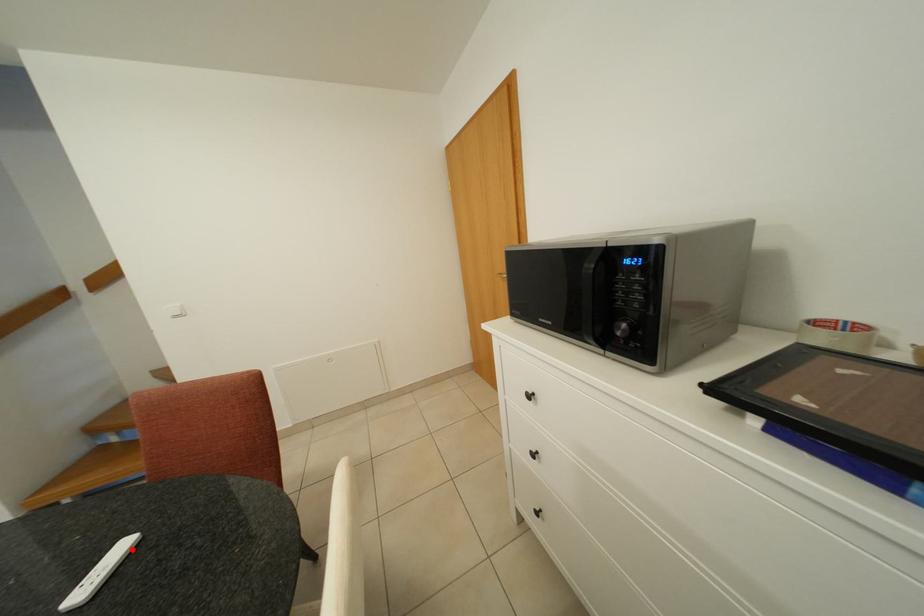
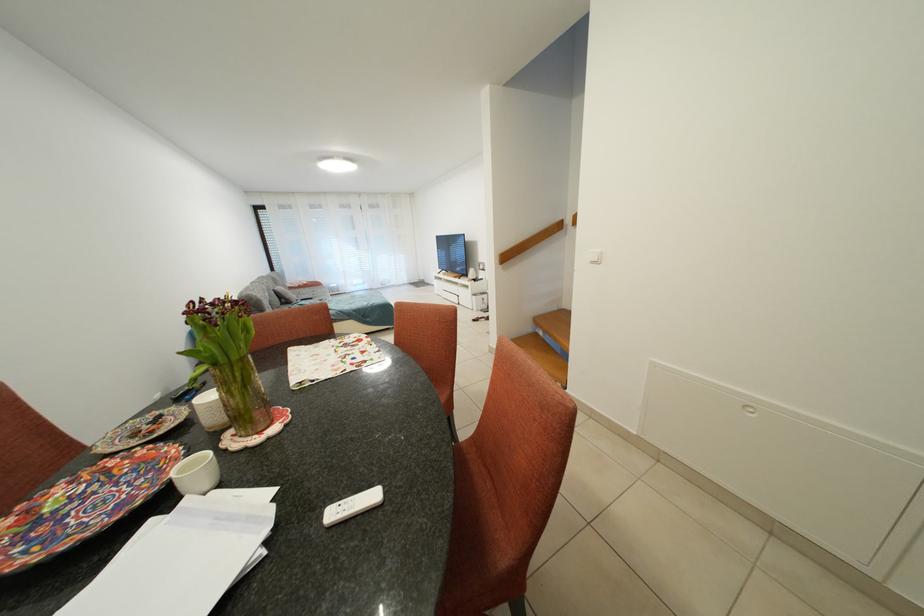
Locate, in the second image, the point that corresponds to the highlighted location in the first image.

(382, 501)